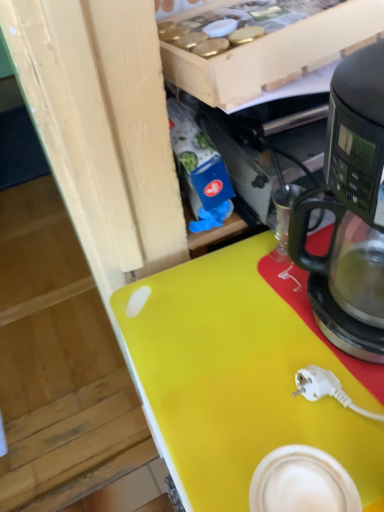
In order to click on free spot to the left of black matte coffee maker at right in this screenshot , I will do `click(217, 347)`.